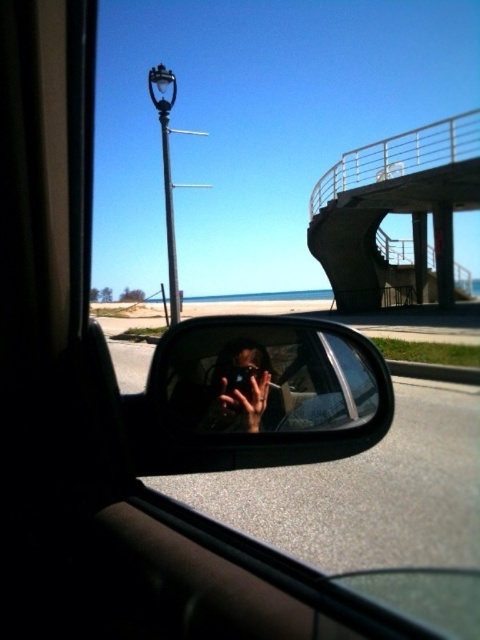
Question: Where is concrete/stone overpass at upper right located in relation to clear plastic mirror at center in the image?

Choices:
 (A) below
 (B) above

Answer: (B)

Question: Which of the following is the farthest from the observer?

Choices:
 (A) (324, 259)
 (B) (205, 413)

Answer: (A)

Question: Is concrete/stone overpass at upper right below clear plastic mirror at center?

Choices:
 (A) yes
 (B) no

Answer: (B)

Question: Does concrete/stone overpass at upper right appear on the left side of clear plastic mirror at center?

Choices:
 (A) no
 (B) yes

Answer: (A)